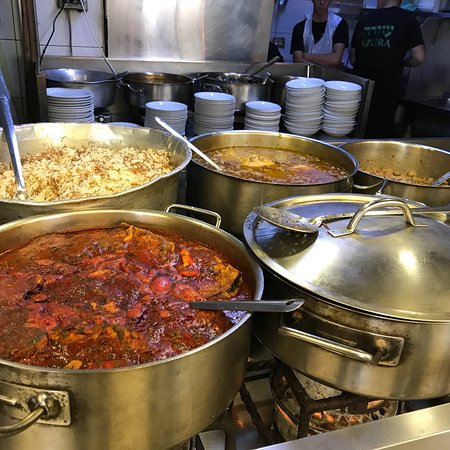
You are a GUI agent. You are given a task and a screenshot of the screen. Output one action in this format:
    pyautogui.click(x=<x>, y=<y>)
    Task: Click on the stove edge
    
    Given the screenshot: What is the action you would take?
    pyautogui.click(x=379, y=440)